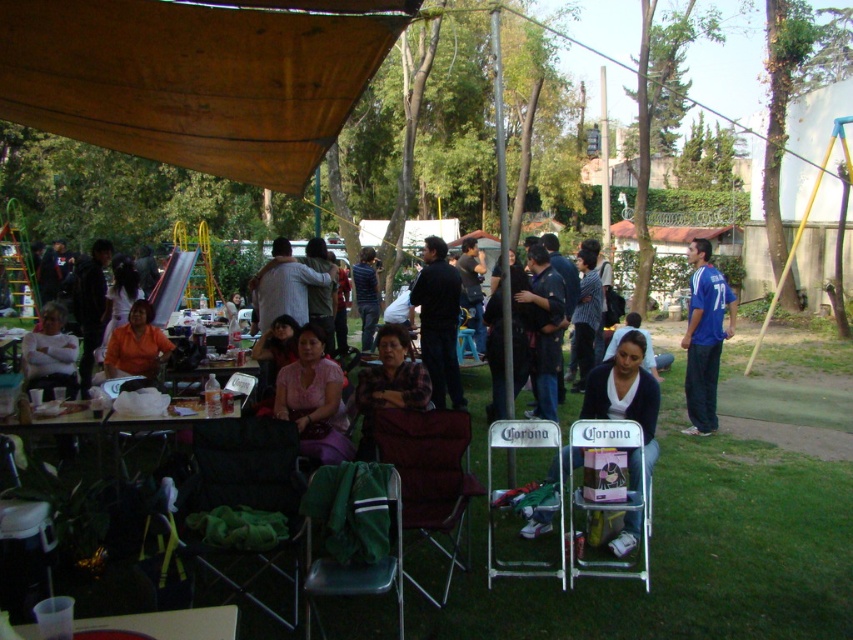
Who is taller, orange matte shirt at center or matte pink shirt at center?

Standing taller between the two is matte pink shirt at center.

From the picture: How much distance is there between orange matte shirt at center and matte pink shirt at center?

They are 3.35 feet apart.

What do you see at coordinates (136, 344) in the screenshot?
I see `orange matte shirt at center` at bounding box center [136, 344].

I want to click on orange matte shirt at center, so click(x=136, y=344).

Who is higher up, maroon fabric chair at center or green fabric chair at lower center?

maroon fabric chair at center is higher up.

Does maroon fabric chair at center have a greater width compared to green fabric chair at lower center?

Yes, maroon fabric chair at center is wider than green fabric chair at lower center.

Does point (422, 528) lie in front of point (374, 580)?

No, it is not.

You are a GUI agent. You are given a task and a screenshot of the screen. Output one action in this format:
    pyautogui.click(x=<x>, y=<y>)
    Task: Click on the maroon fabric chair at center
    Image resolution: width=853 pixels, height=640 pixels.
    Given the screenshot: What is the action you would take?
    pyautogui.click(x=428, y=476)

Can you confirm if brown fabric canopy at upper left is positioned to the right of maroon fabric chair at center?

Incorrect, brown fabric canopy at upper left is not on the right side of maroon fabric chair at center.

Which is in front, point (32, 52) or point (467, 451)?

Positioned in front is point (32, 52).

Which is behind, point (51, 108) or point (445, 492)?

Positioned behind is point (51, 108).

Where is `brown fabric canopy at upper left`? Image resolution: width=853 pixels, height=640 pixels. brown fabric canopy at upper left is located at coordinates (196, 76).